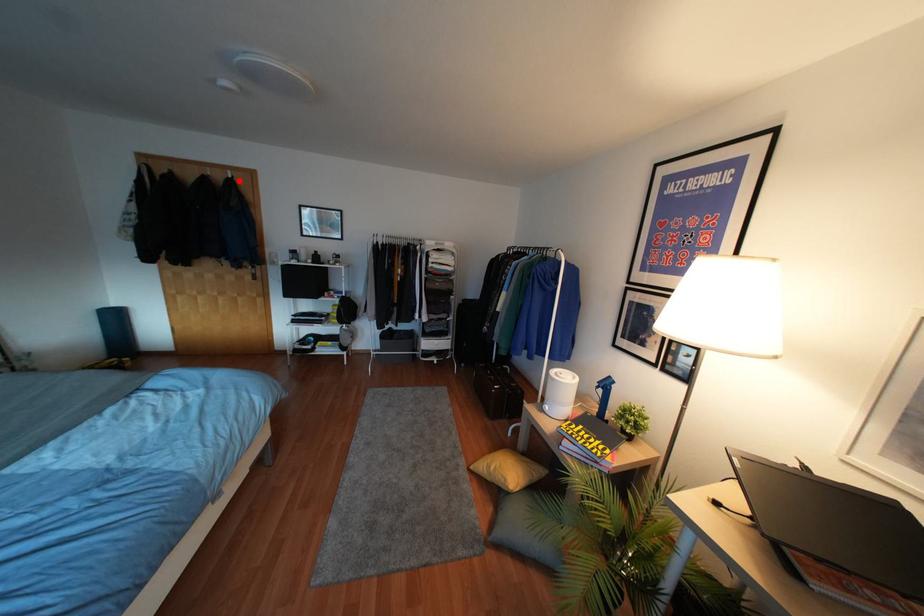
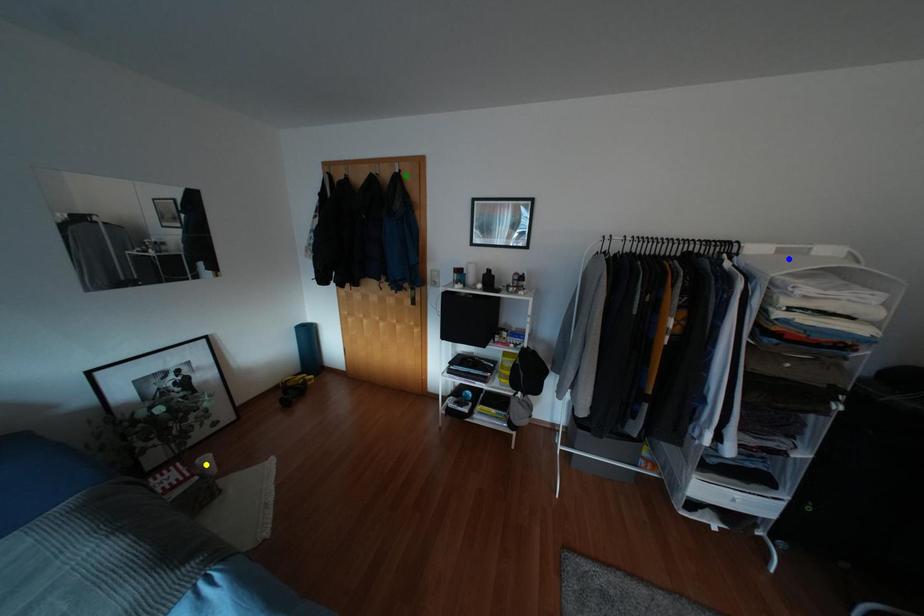
Question: I am providing you with two images of the same scene from different viewpoints. A red point is marked on the first image. You are given multiple points on the second image. Which point in image 2 is actually the same real-world point as the red point in image 1?

Choices:
 (A) green point
 (B) yellow point
 (C) blue point

Answer: (A)